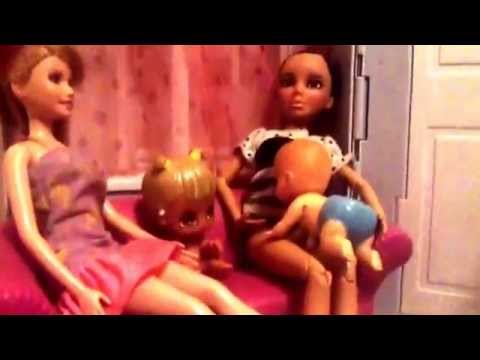
At what (x,y) coordinates should I click in order to perform the action: click on dolls. Please return your answer as a coordinate pair (x, y). Looking at the image, I should click on (43, 146), (161, 193), (294, 201), (279, 137).